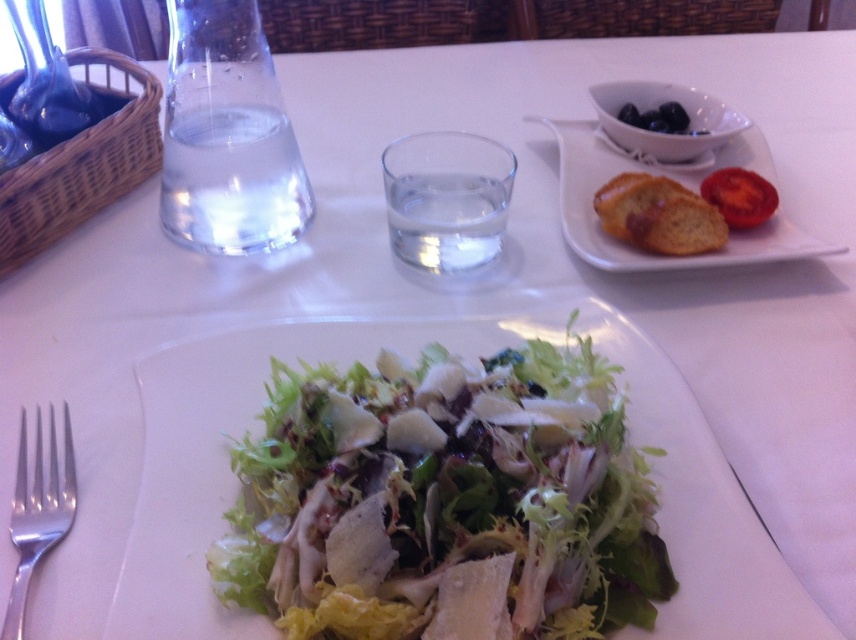
Question: Is clear glass water at center left positioned at the back of golden brown bread at upper right?

Choices:
 (A) yes
 (B) no

Answer: (A)

Question: Can you confirm if clear glass water at center left is bigger than red matte tomato at upper right?

Choices:
 (A) yes
 (B) no

Answer: (A)

Question: Considering the relative positions of clear glass water at center and red matte tomato at upper right in the image provided, where is clear glass water at center located with respect to red matte tomato at upper right?

Choices:
 (A) right
 (B) left

Answer: (B)

Question: Among these points, which one is farthest from the camera?

Choices:
 (A) (664, 268)
 (B) (635, 211)
 (C) (242, 124)
 (D) (727, 182)

Answer: (D)

Question: Which object appears closest to the camera in this image?

Choices:
 (A) clear glass water at center
 (B) green leafy salad at center
 (C) clear glass water at center left
 (D) golden brown crusty bread at upper right

Answer: (B)

Question: Considering the real-world distances, which object is farthest from the clear glass water at center left?

Choices:
 (A) red matte tomato at upper right
 (B) silver metallic fork at lower left
 (C) green leafy salad at center
 (D) clear glass water at center

Answer: (A)